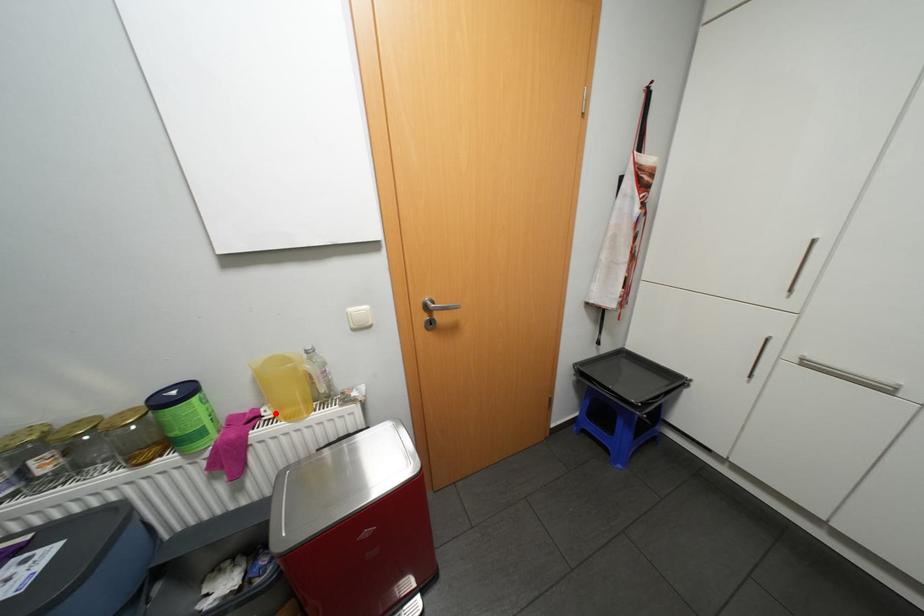
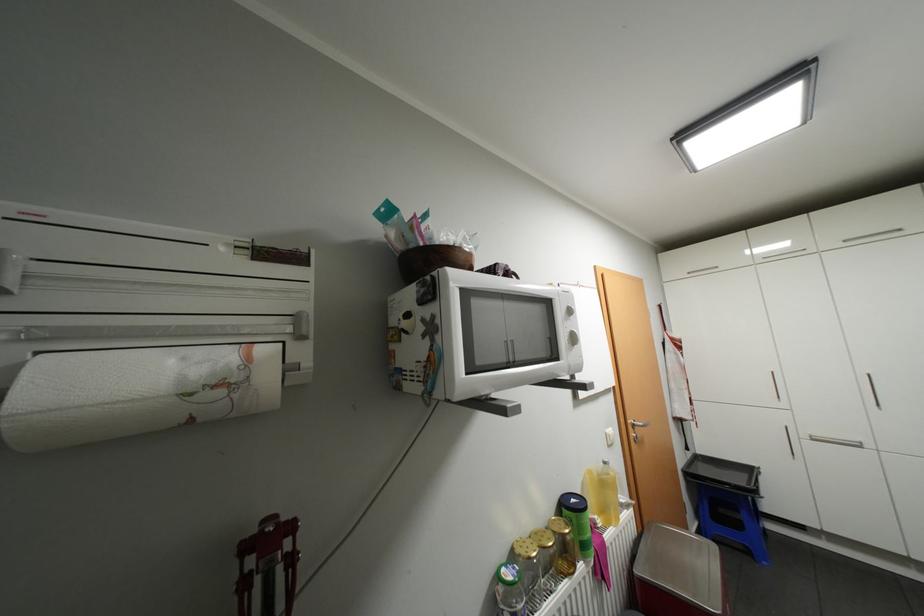
Where in the second image is the point corresponding to the highlighted location from the first image?

(606, 521)